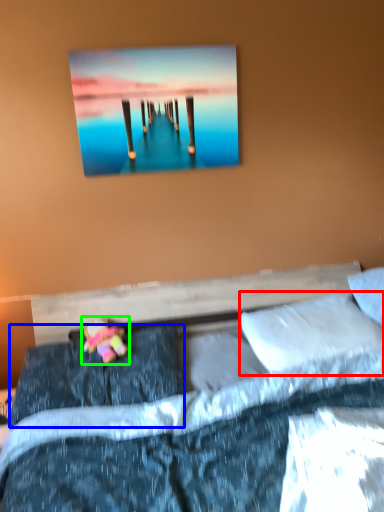
Question: Considering the real-world distances, which object is farthest from pillow (highlighted by a red box)? pillow (highlighted by a blue box) or doll (highlighted by a green box)?

Choices:
 (A) pillow
 (B) doll

Answer: (B)